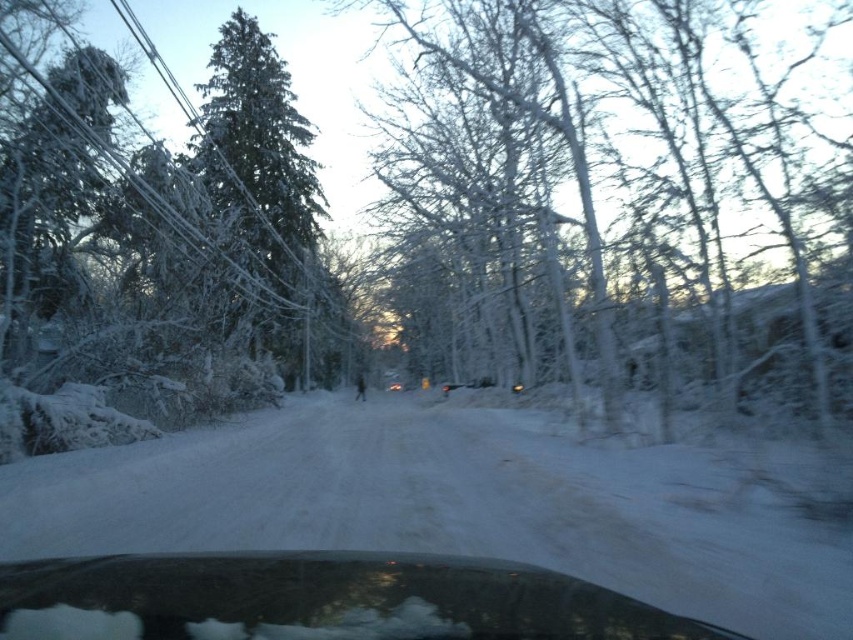
You are sitting in the car and looking out through the transparent glass car window at lower center. You see the white frosty tree at center outside. Is the tree located above or below the window from your viewpoint?

The white frosty tree at center is above the transparent glass car window at lower center from your viewpoint.

In the scene shown: You are driving a car and looking out the window. You see the white fluffy snow at center. Can you determine its exact position using coordinates?

The white fluffy snow at center is located at point (445,504).

You are driving a car and looking out the window. You see the white fluffy snow at center and the green frosted evergreen at left. Which object is closer to your car?

The white fluffy snow at center is closer to your car because it is in front of the green frosted evergreen at left.